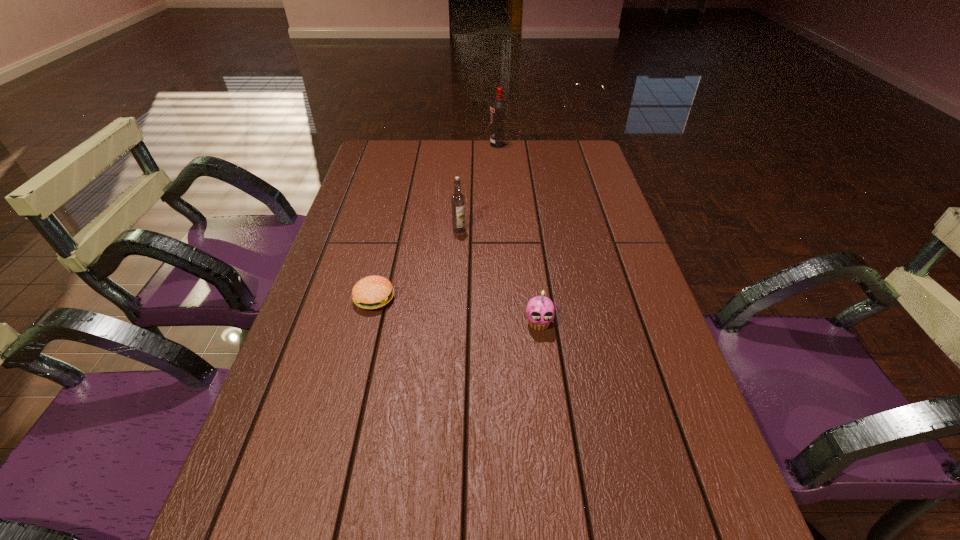
This screenshot has height=540, width=960. In order to click on object that is the closest to the farther vodka in this screenshot , I will do `click(457, 199)`.

Locate an element on the screen. The height and width of the screenshot is (540, 960). object that is the nearest to the rightmost object is located at coordinates [x=372, y=292].

Where is `free spot that satisfies the following two spatial constraints: 1. on the front label of the right vodka; 2. on the label of the left vodka`? free spot that satisfies the following two spatial constraints: 1. on the front label of the right vodka; 2. on the label of the left vodka is located at coordinates (504, 230).

What are the coordinates of `vacant space that satisfies the following two spatial constraints: 1. on the front label of the farther vodka; 2. on the label of the second object from left to right` in the screenshot? It's located at (504, 230).

Locate an element on the screen. The height and width of the screenshot is (540, 960). free space that satisfies the following two spatial constraints: 1. on the front label of the tallest object; 2. on the label of the third shortest object is located at coordinates (504, 230).

Locate an element on the screen. The height and width of the screenshot is (540, 960). free point that satisfies the following two spatial constraints: 1. on the front label of the tallest object; 2. on the label of the shorter vodka is located at coordinates (504, 230).